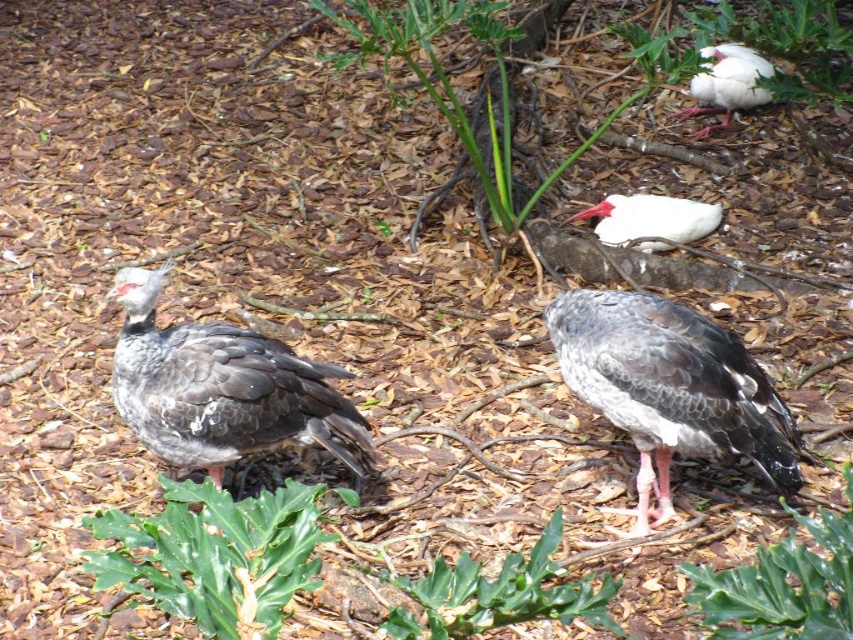
Can you confirm if dark gray feathers at center is positioned to the right of white matte bird at upper right?

No, dark gray feathers at center is not to the right of white matte bird at upper right.

Looking at this image, is the position of dark gray feathers at center more distant than that of white matte bird at upper right?

No, dark gray feathers at center is closer to the viewer.

Which is behind, point (177, 440) or point (714, 129)?

Point (714, 129)

Locate an element on the screen. dark gray feathers at center is located at coordinates (222, 388).

Is point (671, 198) closer to viewer compared to point (730, 58)?

Yes, it is.

Is white matte beak at upper right taller than white matte bird at upper right?

No, white matte beak at upper right is not taller than white matte bird at upper right.

The height and width of the screenshot is (640, 853). Identify the location of white matte beak at upper right. (650, 220).

I want to click on white matte beak at upper right, so click(650, 220).

Does gray matte bird at center come in front of dark gray feathers at center?

No, it is behind dark gray feathers at center.

Is gray matte bird at center thinner than dark gray feathers at center?

In fact, gray matte bird at center might be wider than dark gray feathers at center.

Is point (647, 355) closer to camera compared to point (189, 433)?

Yes.

Locate an element on the screen. gray matte bird at center is located at coordinates (669, 388).